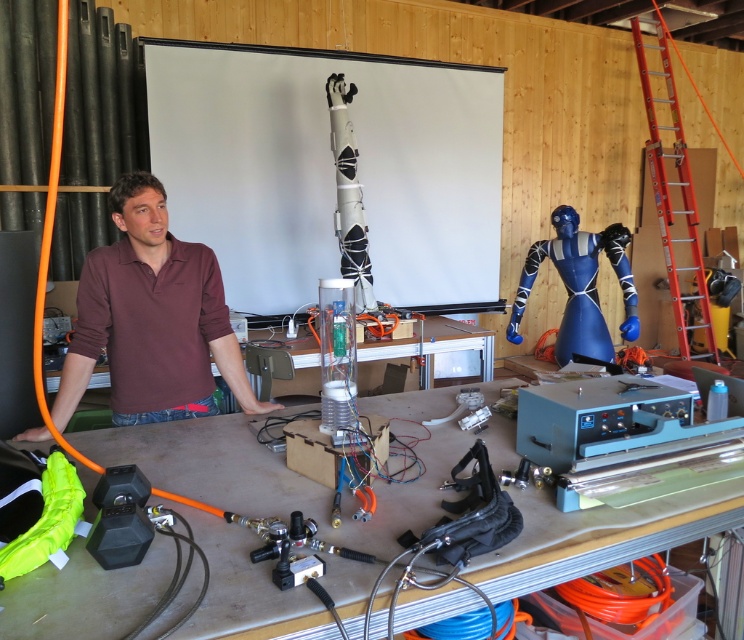
Question: Can you confirm if white matte projection screen at upper center is positioned to the left of matte plastic table at center?

Choices:
 (A) no
 (B) yes

Answer: (B)

Question: Which of these objects is positioned farthest from the white matte projection screen at upper center?

Choices:
 (A) maroon cotton polo shirt at center
 (B) metallic gray table at center
 (C) red metal ladder at right

Answer: (B)

Question: Which point appears farthest from the camera in this image?

Choices:
 (A) (410, 108)
 (B) (289, 353)
 (C) (153, 202)

Answer: (A)

Question: Considering the real-world distances, which object is farthest from the metallic gray table at center?

Choices:
 (A) matte plastic table at center
 (B) red metal ladder at right
 (C) maroon cotton polo shirt at center

Answer: (B)

Question: Does white matte projection screen at upper center have a smaller size compared to matte plastic table at center?

Choices:
 (A) no
 (B) yes

Answer: (A)

Question: Is maroon cotton polo shirt at center smaller than matte plastic table at center?

Choices:
 (A) yes
 (B) no

Answer: (A)